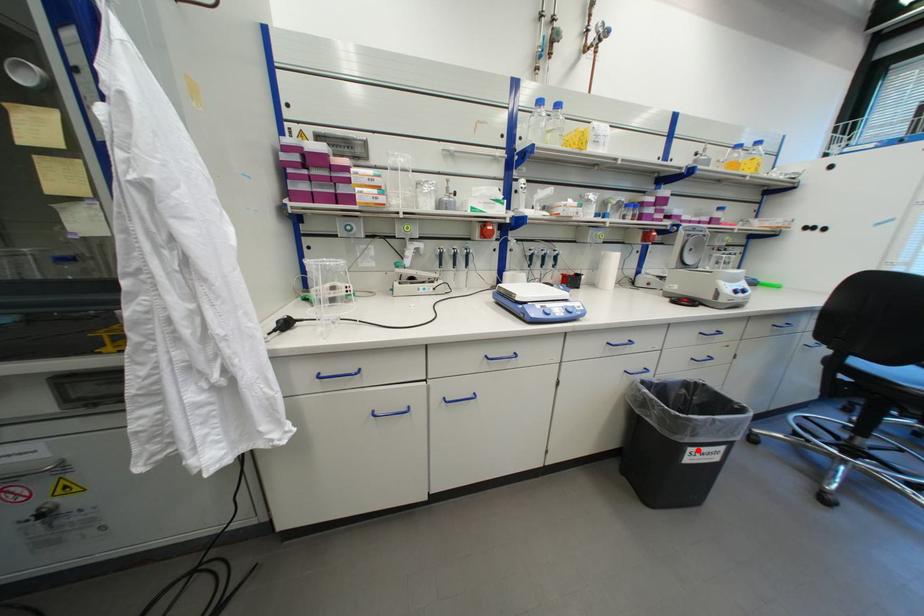
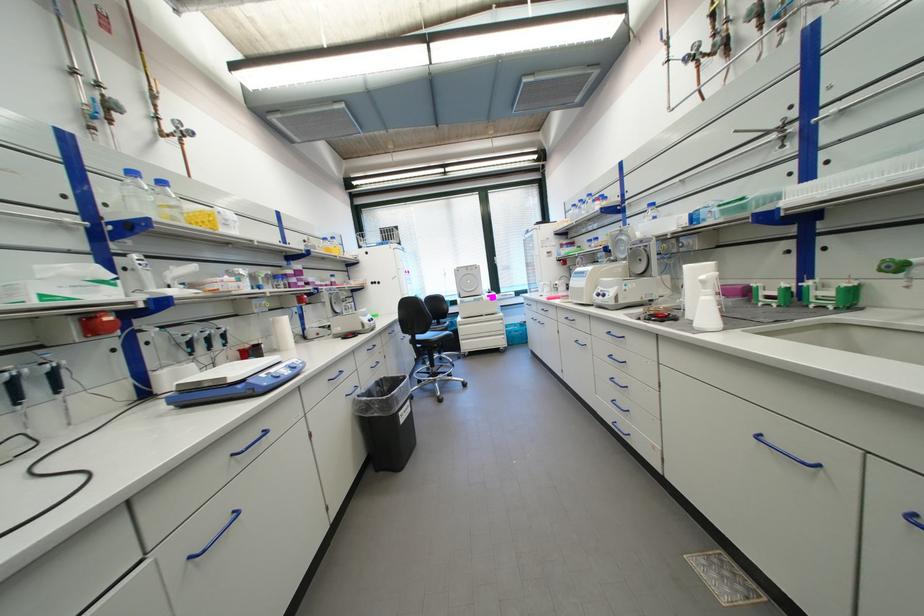
Question: A red point is marked in image1. In image2, is the corresponding 3D point closer to the camera or farther? Reply with the corresponding letter.

Choices:
 (A) The corresponding 3D point is closer.
 (B) The corresponding 3D point is farther.

Answer: (A)